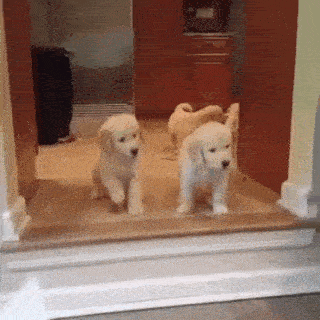
This screenshot has width=320, height=320. Find the location of `cabinet`. cabinet is located at coordinates (182, 44).